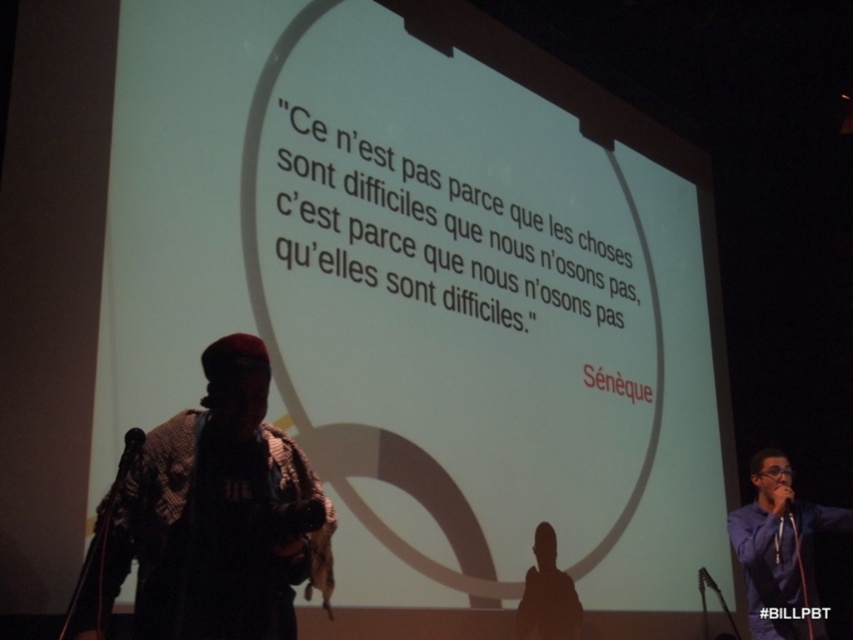
Question: Which point is farther to the camera?

Choices:
 (A) black matte silhouette at lower center
 (B) purple shirt at lower right

Answer: (B)

Question: Does knitted wool scarf at left appear on the left side of black matte silhouette at lower center?

Choices:
 (A) no
 (B) yes

Answer: (B)

Question: Does knitted wool scarf at left appear on the right side of black matte microphone at lower left?

Choices:
 (A) no
 (B) yes

Answer: (B)

Question: Does black matte silhouette at lower center come in front of black matte microphone at lower left?

Choices:
 (A) no
 (B) yes

Answer: (A)

Question: Which object appears farthest from the camera in this image?

Choices:
 (A) black matte silhouette at lower center
 (B) knitted wool scarf at left

Answer: (A)

Question: Among these objects, which one is nearest to the camera?

Choices:
 (A) knitted wool scarf at left
 (B) white matte projection screen at upper center
 (C) purple shirt at lower right
 (D) black matte microphone at lower left

Answer: (A)